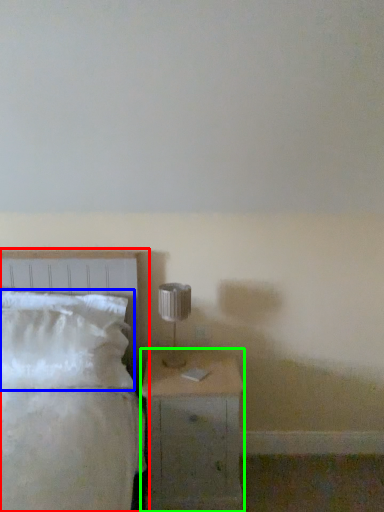
Question: Which object is the farthest from bed (highlighted by a red box)? Choose among these: pillow (highlighted by a blue box) or nightstand (highlighted by a green box).

Choices:
 (A) pillow
 (B) nightstand

Answer: (B)